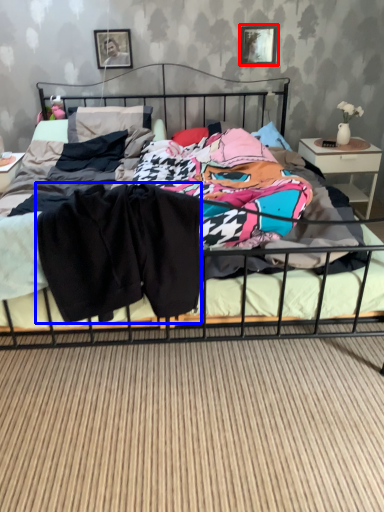
Question: Which of the following is the closest to the observer, picture frame (highlighted by a red box) or clothing (highlighted by a blue box)?

Choices:
 (A) picture frame
 (B) clothing

Answer: (B)